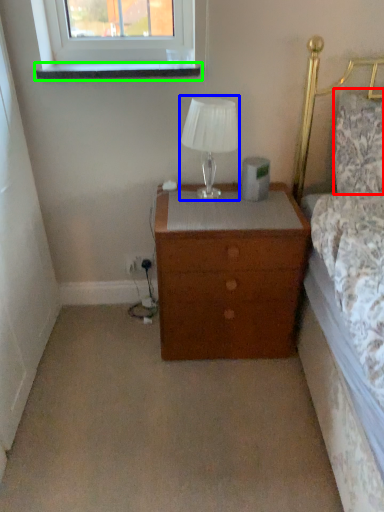
Question: Which object is the farthest from pillow (highlighted by a red box)? Choose among these: table lamp (highlighted by a blue box) or window sill (highlighted by a green box).

Choices:
 (A) table lamp
 (B) window sill

Answer: (B)